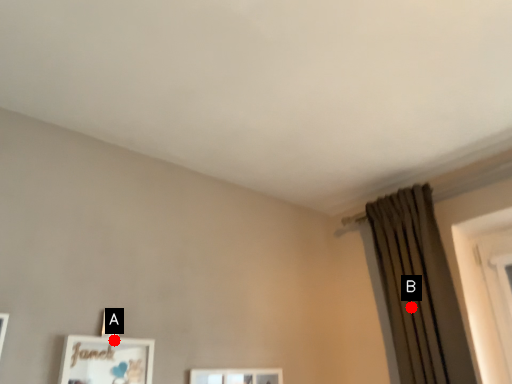
Question: Two points are circled on the image, labeled by A and B beside each circle. Which point is farther to the camera?

Choices:
 (A) A is further
 (B) B is further

Answer: (B)